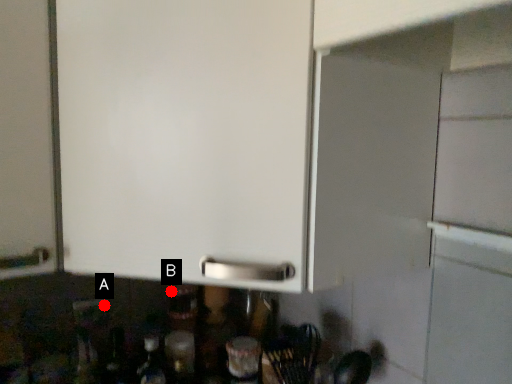
Question: Two points are circled on the image, labeled by A and B beside each circle. Which point is further to the camera?

Choices:
 (A) A is further
 (B) B is further

Answer: (B)